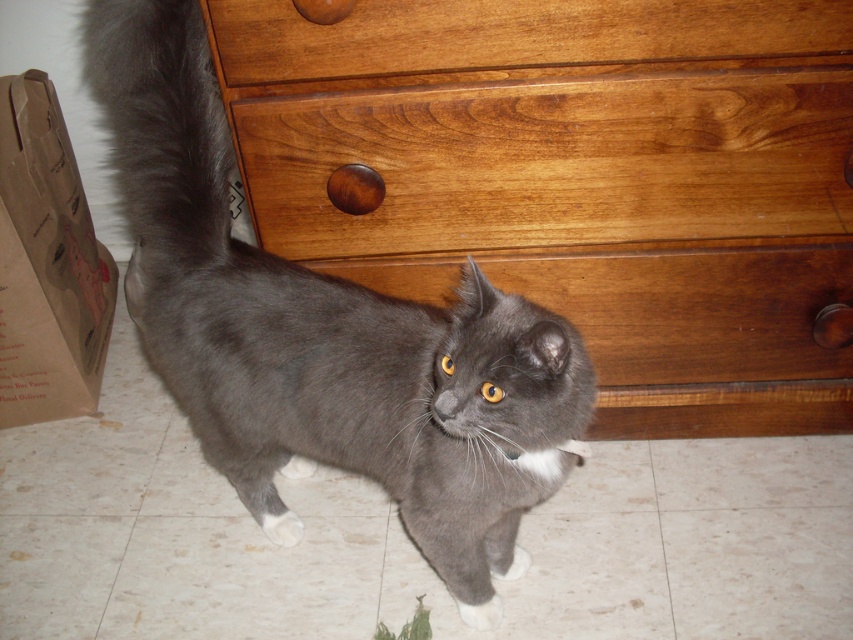
Question: Is wooden dresser at center thinner than white fur paw at lower center?

Choices:
 (A) yes
 (B) no

Answer: (B)

Question: Which object is closer to the camera taking this photo?

Choices:
 (A) wooden drawer at upper center
 (B) wooden dresser at center
 (C) wooden drawer at center

Answer: (A)

Question: Which point is closer to the camera?

Choices:
 (A) (746, 54)
 (B) (317, 42)
 (C) (155, 22)
 (D) (270, 538)

Answer: (C)

Question: Among these objects, which one is farthest from the camera?

Choices:
 (A) wooden dresser at center
 (B) gray fur cat at center
 (C) wooden drawer at upper center
 (D) wooden drawer at center

Answer: (D)

Question: Can you confirm if gray fur cat at center is wider than wooden drawer at upper center?

Choices:
 (A) no
 (B) yes

Answer: (A)

Question: Is wooden drawer at upper center to the left of gray fluffy tail at upper left from the viewer's perspective?

Choices:
 (A) no
 (B) yes

Answer: (A)